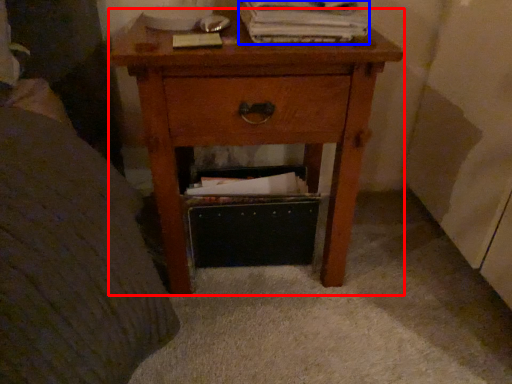
Question: Which object appears closest to the camera in this image, nightstand (highlighted by a red box) or paperback book (highlighted by a blue box)?

Choices:
 (A) nightstand
 (B) paperback book

Answer: (A)